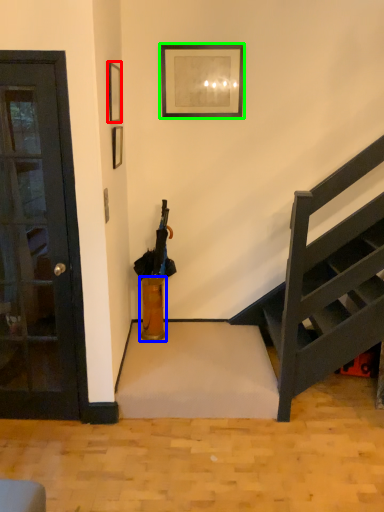
Question: Based on their relative distances, which object is farther from picture frame (highlighted by a red box)? Choose from vase (highlighted by a blue box) and picture frame (highlighted by a green box).

Choices:
 (A) vase
 (B) picture frame

Answer: (A)